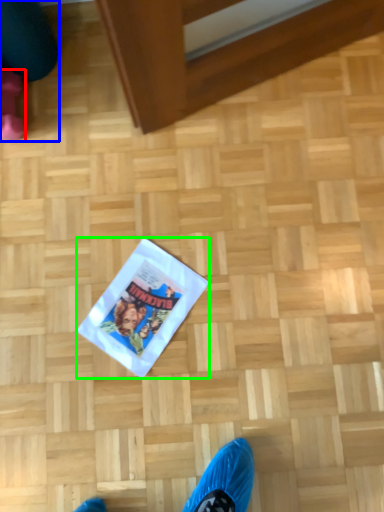
Question: Based on their relative distances, which object is farther from footwear (highlighted by a red box)? Choose from leg (highlighted by a blue box) and flyer (highlighted by a green box).

Choices:
 (A) leg
 (B) flyer

Answer: (B)